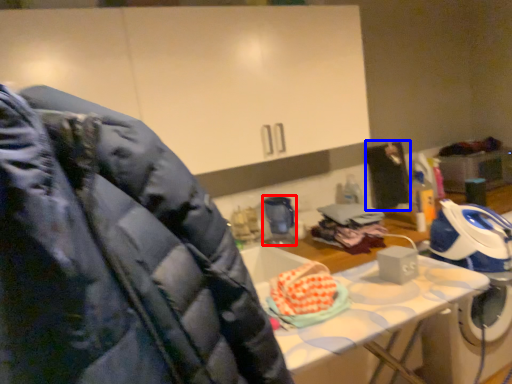
Question: Which object appears closest to the camera in this image, appliance (highlighted by a red box) or person (highlighted by a blue box)?

Choices:
 (A) appliance
 (B) person

Answer: (A)